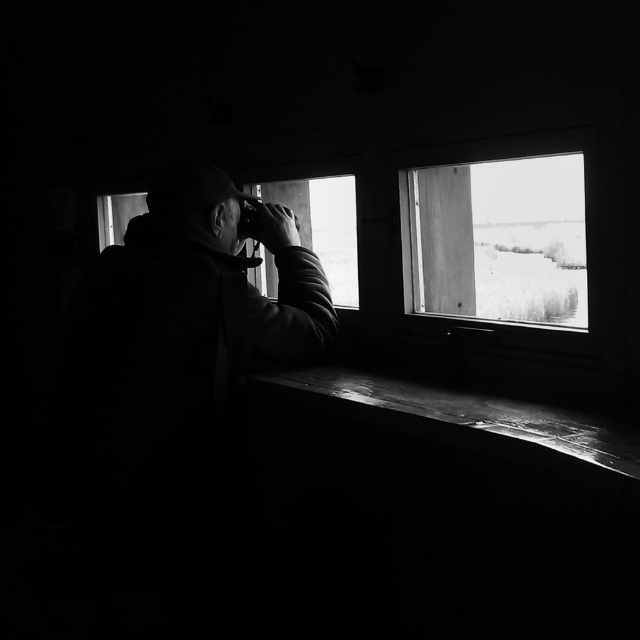
Question: Can you confirm if clear glass window at upper right is wider than transparent glass window at center?

Choices:
 (A) yes
 (B) no

Answer: (A)

Question: Which is nearer to the clear glass window at upper right?

Choices:
 (A) transparent glass window at center
 (B) smooth wood window sill at lower center

Answer: (A)

Question: Does clear glass window at upper right appear on the left side of smooth wood window sill at lower center?

Choices:
 (A) no
 (B) yes

Answer: (A)

Question: Which of the following is the closest to the observer?

Choices:
 (A) smooth wood window sill at lower center
 (B) transparent glass window at center

Answer: (A)

Question: Does clear glass window at upper right have a larger size compared to smooth wood window sill at lower center?

Choices:
 (A) no
 (B) yes

Answer: (B)

Question: Which point is farther to the camera?

Choices:
 (A) (582, 280)
 (B) (451, 420)

Answer: (A)